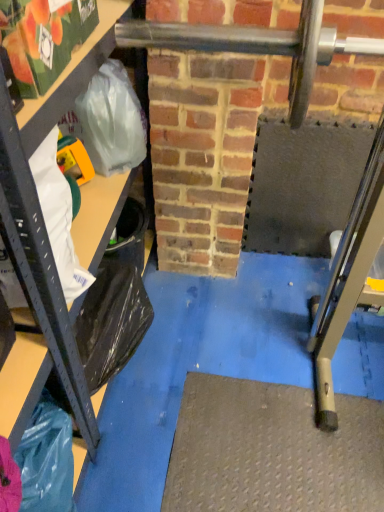
Question: Is point (43, 204) positioned closer to the camera than point (16, 170)?

Choices:
 (A) closer
 (B) farther

Answer: (B)

Question: From a real-world perspective, relative to metallic gray shelf at left, is white plastic grocery bag at left vertically above or below?

Choices:
 (A) above
 (B) below

Answer: (A)

Question: Is white plastic grocery bag at left taller or shorter than metallic gray shelf at left?

Choices:
 (A) short
 (B) tall

Answer: (A)

Question: Considering the positions of metallic gray shelf at left and white plastic grocery bag at left in the image, is metallic gray shelf at left bigger or smaller than white plastic grocery bag at left?

Choices:
 (A) big
 (B) small

Answer: (A)

Question: Is point (84, 251) closer or farther from the camera than point (56, 160)?

Choices:
 (A) farther
 (B) closer

Answer: (A)

Question: Is metallic gray shelf at left taller or shorter than white plastic grocery bag at left?

Choices:
 (A) short
 (B) tall

Answer: (B)

Question: Choose the correct answer: Is metallic gray shelf at left inside white plastic grocery bag at left or outside it?

Choices:
 (A) outside
 (B) inside

Answer: (A)